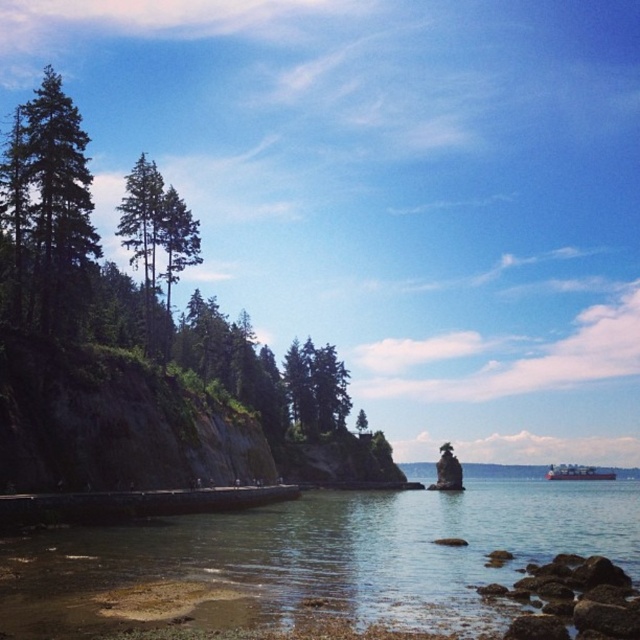
Question: Is green matte tree at left above green matte tree at center?

Choices:
 (A) no
 (B) yes

Answer: (B)

Question: Among these points, which one is nearest to the camera?

Choices:
 (A) [x=56, y=164]
 (B) [x=552, y=609]
 (C) [x=547, y=476]
 (D) [x=74, y=588]

Answer: (B)

Question: Which of the following is the farthest from the observer?

Choices:
 (A) clear water at center
 (B) green matte tree at left

Answer: (B)

Question: Which point is closer to the camera?

Choices:
 (A) brown rough rocks at lower right
 (B) white matte cargo ship at lower right
 (C) green matte tree at center
 (D) green matte tree at left

Answer: (A)

Question: Is green matte tree at left closer to the viewer compared to white matte cargo ship at lower right?

Choices:
 (A) no
 (B) yes

Answer: (B)

Question: Is green matte tree at left positioned before brown rough rocks at lower right?

Choices:
 (A) no
 (B) yes

Answer: (A)